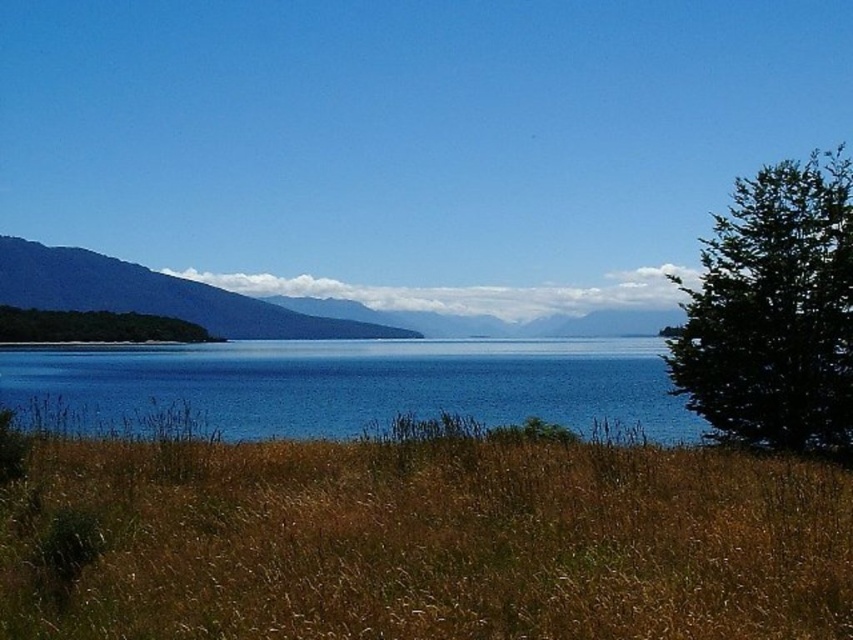
Between point (741, 515) and point (28, 304), which one is positioned in front?

Point (741, 515) is in front.

At what (x,y) coordinates should I click in order to perform the action: click on brown dry grass at lower center. Please return your answer as a coordinate pair (x, y). Looking at the image, I should click on (422, 540).

Which is more to the left, blue water at center or green leafy tree at right?

From the viewer's perspective, blue water at center appears more on the left side.

The width and height of the screenshot is (853, 640). I want to click on blue water at center, so click(345, 387).

What are the coordinates of `blue water at center` in the screenshot? It's located at (345, 387).

Between green forested mountain at left and green leafy tree at left, which one appears on the right side from the viewer's perspective?

green forested mountain at left

Does green forested mountain at left have a greater width compared to green leafy tree at left?

Yes, green forested mountain at left is wider than green leafy tree at left.

Which is in front, point (68, 266) or point (10, 326)?

Point (10, 326) is in front.

The width and height of the screenshot is (853, 640). I want to click on green forested mountain at left, so click(155, 296).